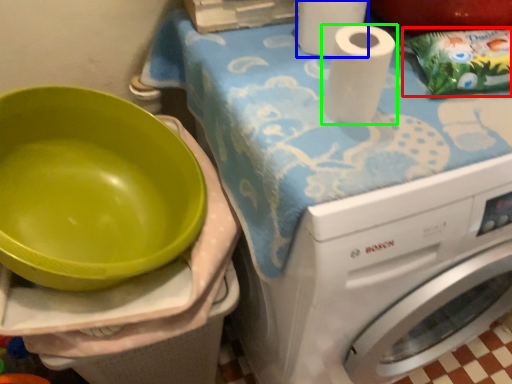
Question: Which object is the farthest from waste (highlighted by a red box)? Choose among these: paper towel (highlighted by a blue box) or paper towel (highlighted by a green box).

Choices:
 (A) paper towel
 (B) paper towel

Answer: (A)